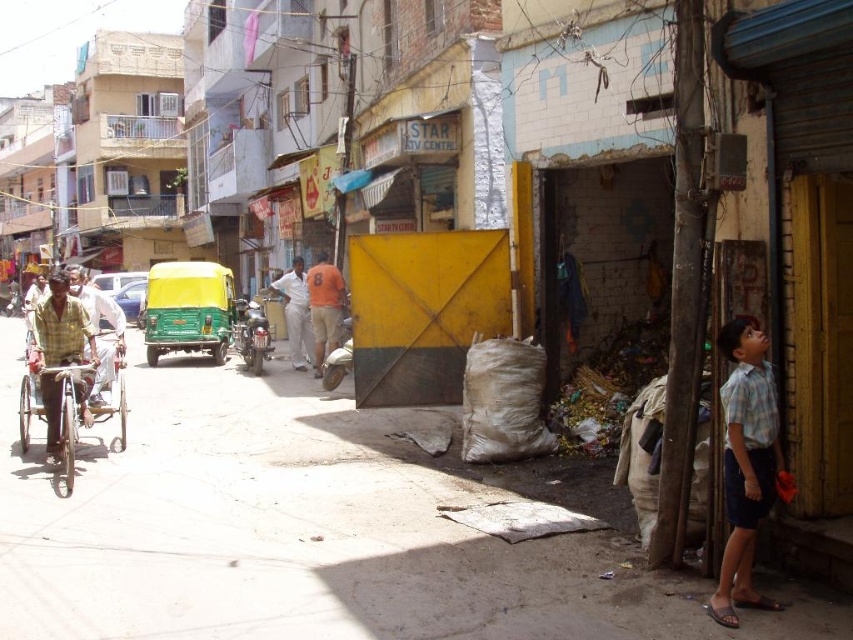
Question: Is green matte auto-rickshaw at center-left positioned in front of white cotton pants at center?

Choices:
 (A) yes
 (B) no

Answer: (B)

Question: Is white plastic bag at lower center closer to the viewer compared to checkered fabric rickshaw at left?

Choices:
 (A) no
 (B) yes

Answer: (B)

Question: Which of the following is the closest to the observer?

Choices:
 (A) (9, 397)
 (B) (323, 282)
 (C) (27, 432)
 (D) (223, 266)

Answer: (C)

Question: Can you confirm if green matte auto-rickshaw at center-left is positioned below white cotton pants at center?

Choices:
 (A) yes
 (B) no

Answer: (B)

Question: Which point appears farthest from the camera in this image?

Choices:
 (A) (718, 612)
 (B) (631, 557)
 (C) (329, 268)

Answer: (C)

Question: Which point is farther from the camera taking this photo?

Choices:
 (A) (59, 445)
 (B) (289, 356)
 (C) (337, 273)
 (D) (96, 394)

Answer: (B)